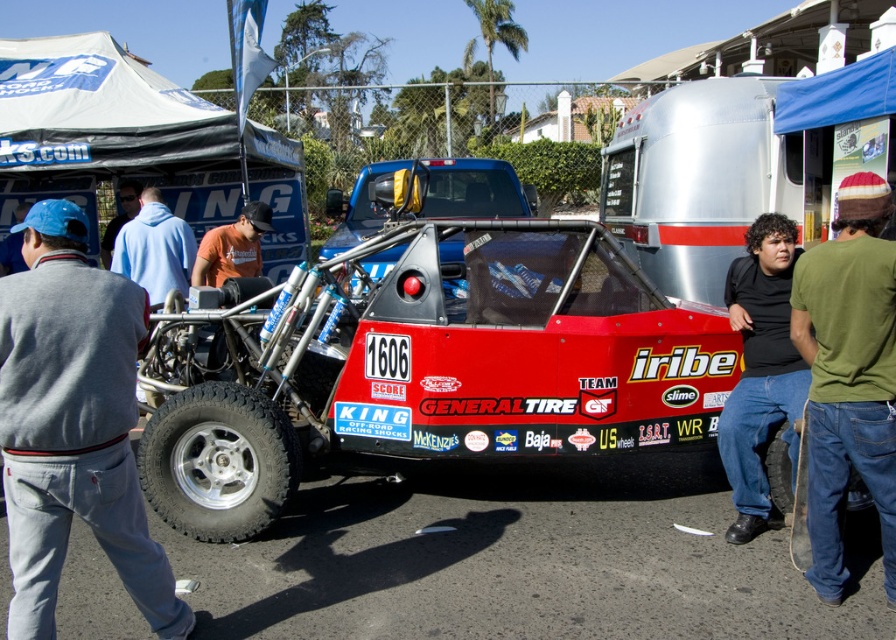
You are a race car driver preparing to start the race. You notice two points marked on your map. The first point is at coordinate point (277, 481) and the second point is at coordinate point (782, 296). According to the scene description, which point is closer to the starting line where you are positioned?

Point (277, 481) is in front of point (782, 296), so the first point is closer to the starting line.

You are a photographer standing at the rear of the red and black race car with the number 1606. You want to take a photo that includes both the point at the front bumper labeled as point (885, 509) and the point at the rear bumper labeled as point (118, 216). Which point will appear larger in the photo?

The point at (885, 509) will appear larger in the photo because it is closer to the camera than the point at (118, 216).